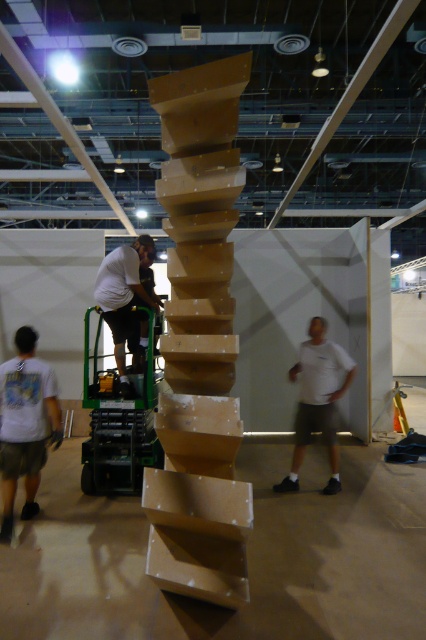
Question: Is white t-shirt at lower left bigger than white matte shirt at right?

Choices:
 (A) yes
 (B) no

Answer: (B)

Question: Which point is farther to the camera?

Choices:
 (A) (123, 284)
 (B) (316, 348)

Answer: (A)

Question: Which object appears closest to the camera in this image?

Choices:
 (A) white matte shirt at center
 (B) white matte shirt at right
 (C) white t-shirt at lower left

Answer: (C)

Question: Is white t-shirt at lower left in front of white matte shirt at center?

Choices:
 (A) yes
 (B) no

Answer: (A)

Question: Does white t-shirt at lower left have a greater width compared to white matte shirt at right?

Choices:
 (A) yes
 (B) no

Answer: (B)

Question: Which object appears farthest from the camera in this image?

Choices:
 (A) white matte shirt at right
 (B) white matte shirt at center
 (C) white t-shirt at lower left

Answer: (B)